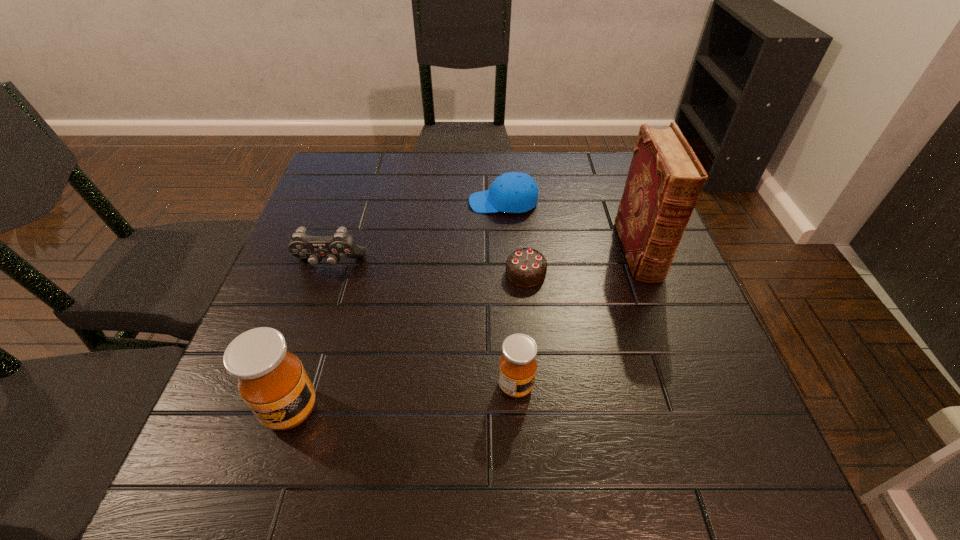
At what (x,y) coordinates should I click in order to perform the action: click on the taller honey. Please return your answer as a coordinate pair (x, y). Image resolution: width=960 pixels, height=540 pixels. Looking at the image, I should click on (272, 381).

Locate an element on the screen. Image resolution: width=960 pixels, height=540 pixels. the left honey is located at coordinates (272, 381).

In order to click on the shorter honey in this screenshot , I will do `click(517, 365)`.

Locate an element on the screen. the shortest object is located at coordinates (525, 267).

At what (x,y) coordinates should I click in order to perform the action: click on the farthest object. Please return your answer as a coordinate pair (x, y). This screenshot has width=960, height=540. Looking at the image, I should click on (514, 192).

At what (x,y) coordinates should I click in order to perform the action: click on cap. Please return your answer as a coordinate pair (x, y). Looking at the image, I should click on (514, 192).

The image size is (960, 540). Find the location of `control`. control is located at coordinates (342, 245).

Identify the location of hardback book. This screenshot has height=540, width=960. (665, 179).

Find the location of `the tallest object`. the tallest object is located at coordinates (665, 179).

The image size is (960, 540). Find the location of `free space located on the front-facing side of the right honey`. free space located on the front-facing side of the right honey is located at coordinates (714, 386).